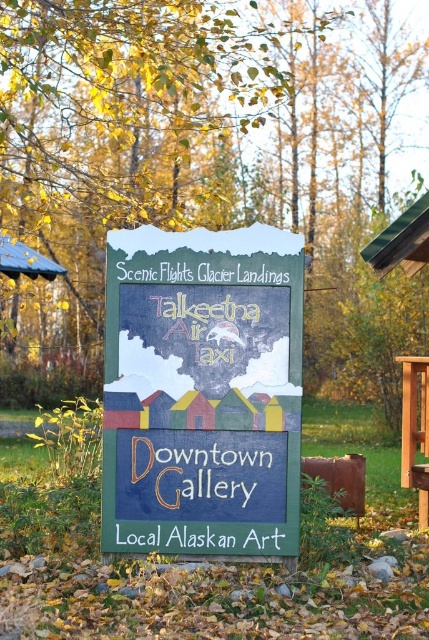
Is wooden signboard at center in front of brown wooden picnic table at right?

Yes, it is.

Does wooden signboard at center appear over brown wooden picnic table at right?

Yes, wooden signboard at center is above brown wooden picnic table at right.

Where is `wooden signboard at center`? This screenshot has height=640, width=429. wooden signboard at center is located at coordinates (202, 390).